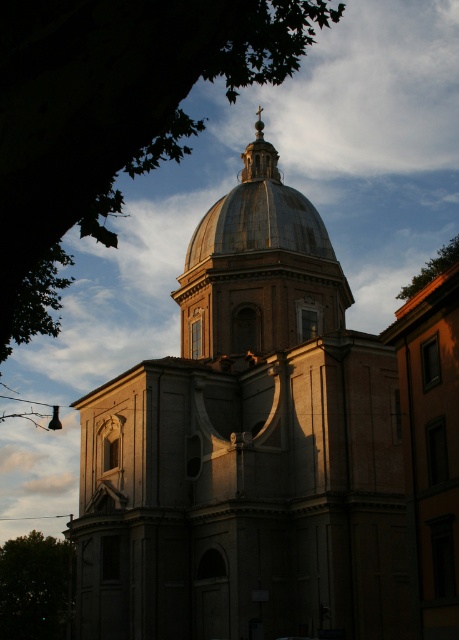
Question: Is gray stone dome at center thinner than green leafy tree at upper right?

Choices:
 (A) no
 (B) yes

Answer: (A)

Question: Which object is farther from the camera taking this photo?

Choices:
 (A) gray stone dome at center
 (B) green leafy tree at lower left

Answer: (B)

Question: Which of these objects is positioned closest to the gold textured dome at center?

Choices:
 (A) gray stone dome at center
 (B) green leafy tree at upper left
 (C) green leafy tree at upper right

Answer: (C)

Question: Is gray stone dome at center smaller than shiny metallic dome at center?

Choices:
 (A) no
 (B) yes

Answer: (A)

Question: Is green leafy tree at upper left wider than shiny metallic dome at center?

Choices:
 (A) yes
 (B) no

Answer: (A)

Question: Which point appears farthest from the camera in this image?

Choices:
 (A) (244, 150)
 (B) (275, 348)
 (C) (430, 259)

Answer: (C)